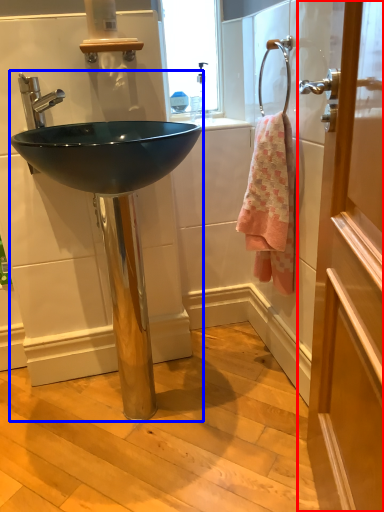
Question: Among these objects, which one is farthest to the camera, door (highlighted by a red box) or sink (highlighted by a blue box)?

Choices:
 (A) door
 (B) sink

Answer: (B)